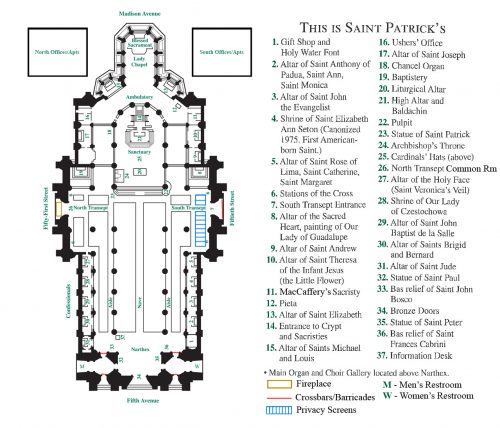
This screenshot has height=428, width=500. Identify the location of altars. (135, 55).